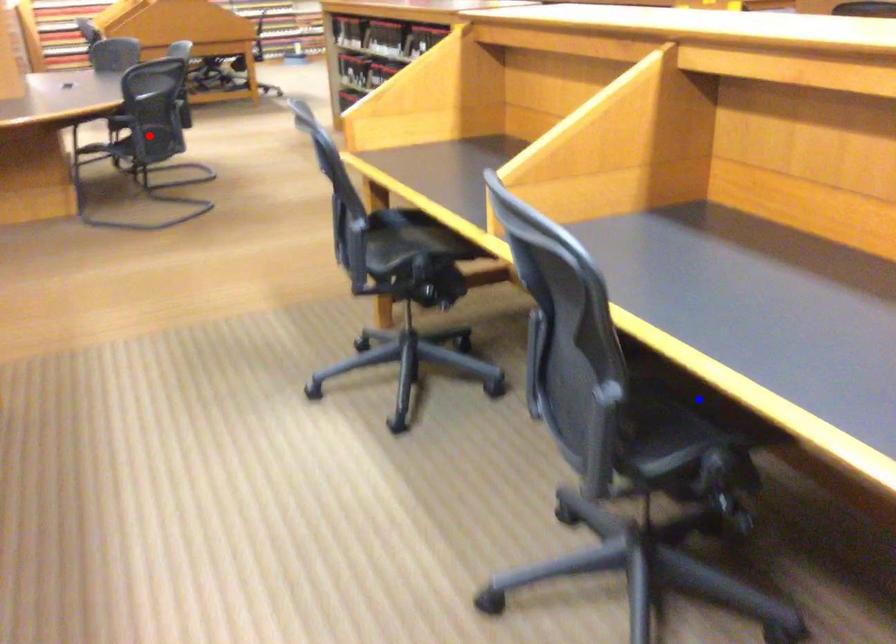
Question: Two points are marked on the image. Which point is closer to the camera?

Choices:
 (A) Blue point is closer.
 (B) Red point is closer.

Answer: (A)